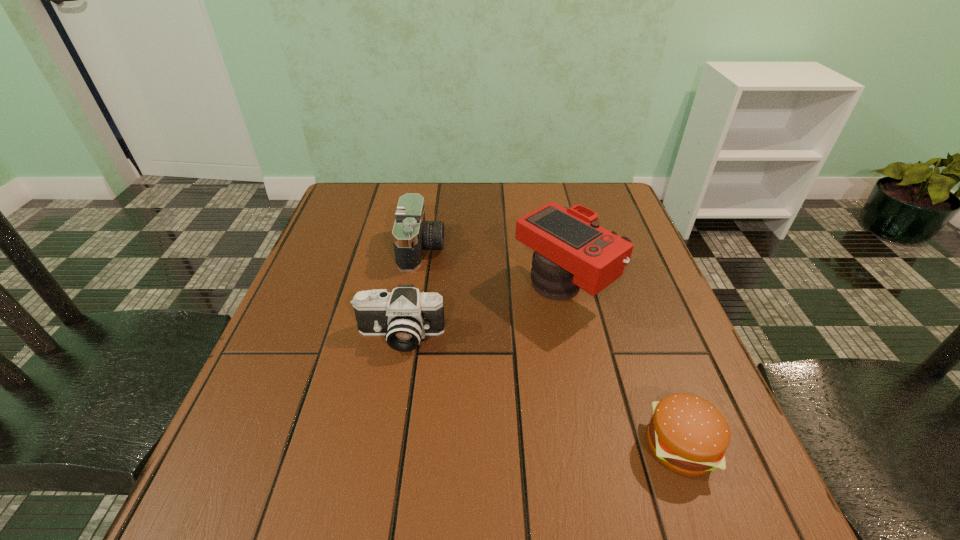
At what (x,y) coordinates should I click in order to perform the action: click on the rightmost camera. Please return your answer as a coordinate pair (x, y). The height and width of the screenshot is (540, 960). Looking at the image, I should click on (571, 251).

This screenshot has height=540, width=960. In order to click on the tallest camera in this screenshot , I will do `click(571, 251)`.

Find the location of a particular element. The width and height of the screenshot is (960, 540). the nearest object is located at coordinates (688, 435).

This screenshot has width=960, height=540. I want to click on hamburger, so click(x=688, y=435).

Find the location of a particular element. This screenshot has height=540, width=960. vacant space located on the right of the tallest camera is located at coordinates pyautogui.click(x=636, y=289).

Identify the location of vacant space situated on the left of the shortest object. (455, 446).

Identify the location of object that is at the near edge. This screenshot has height=540, width=960. (688, 435).

You are a GUI agent. You are given a task and a screenshot of the screen. Output one action in this format:
    pyautogui.click(x=<x>, y=<y>)
    Task: Click on the camera that is at the right edge
    
    Given the screenshot: What is the action you would take?
    pyautogui.click(x=571, y=251)

Where is `hamburger that is at the right edge`? hamburger that is at the right edge is located at coordinates (688, 435).

Locate an element on the screen. object that is positioned at the near right corner is located at coordinates (688, 435).